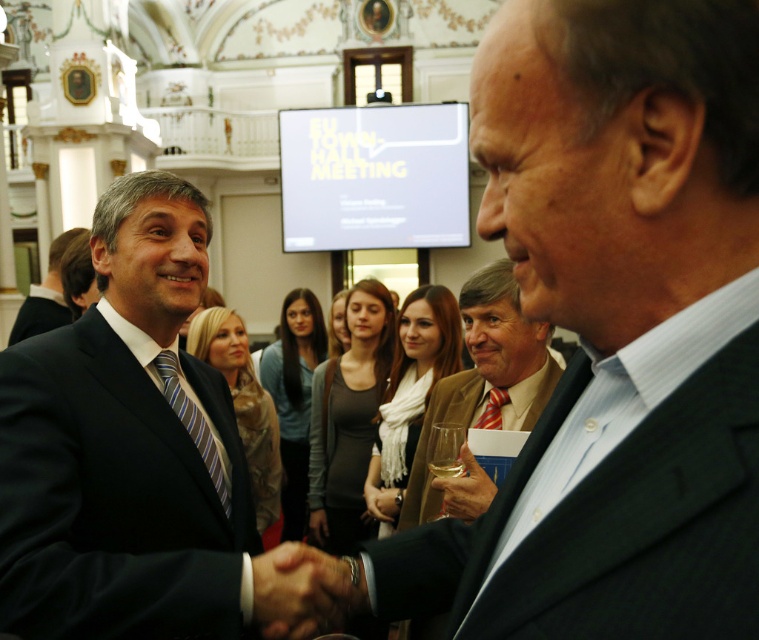
Question: Is smooth leather hand at center in front of striped fabric tie at center?

Choices:
 (A) no
 (B) yes

Answer: (B)

Question: Can you confirm if matte black suit at center is positioned to the right of striped fabric tie at center?

Choices:
 (A) yes
 (B) no

Answer: (B)

Question: Does matte black suit at center have a smaller size compared to smooth leather hand at center?

Choices:
 (A) no
 (B) yes

Answer: (A)

Question: Which point appears closest to the camera in this image?

Choices:
 (A) (263, 620)
 (B) (109, 296)

Answer: (A)

Question: Which of the following is the farthest from the observer?

Choices:
 (A) (468, 628)
 (B) (46, 273)

Answer: (B)

Question: Which object is positioned closest to the striped fabric tie at center?

Choices:
 (A) black matte suit at left
 (B) dark blue suit at center
 (C) striped silk tie at center

Answer: (C)